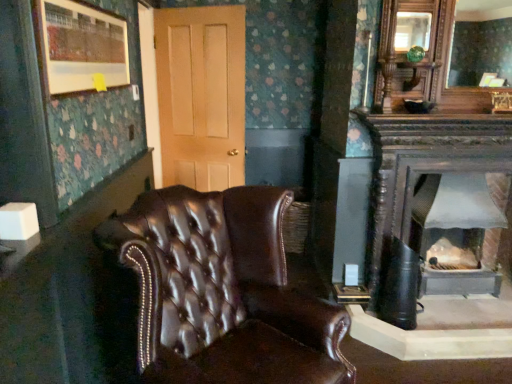
Question: Considering the relative positions of matte wooden mirror at upper right and matte wooden picture frame at upper left in the image provided, is matte wooden mirror at upper right to the right of matte wooden picture frame at upper left from the viewer's perspective?

Choices:
 (A) no
 (B) yes

Answer: (B)

Question: Would you say matte wooden mirror at upper right is outside matte wooden picture frame at upper left?

Choices:
 (A) no
 (B) yes

Answer: (B)

Question: Can you confirm if matte wooden mirror at upper right is thinner than matte wooden picture frame at upper left?

Choices:
 (A) no
 (B) yes

Answer: (A)

Question: Does matte wooden mirror at upper right appear on the left side of matte wooden picture frame at upper left?

Choices:
 (A) no
 (B) yes

Answer: (A)

Question: From the image's perspective, is matte wooden mirror at upper right on top of matte wooden picture frame at upper left?

Choices:
 (A) no
 (B) yes

Answer: (B)

Question: Is matte wooden mirror at upper right facing away from matte wooden picture frame at upper left?

Choices:
 (A) no
 (B) yes

Answer: (A)

Question: Could you tell me if matte wooden mirror at upper right is facing brown leather chair at center?

Choices:
 (A) yes
 (B) no

Answer: (B)

Question: Is matte wooden mirror at upper right positioned in front of brown leather chair at center?

Choices:
 (A) yes
 (B) no

Answer: (B)

Question: Does matte wooden mirror at upper right have a lesser height compared to brown leather chair at center?

Choices:
 (A) yes
 (B) no

Answer: (A)

Question: Are matte wooden mirror at upper right and brown leather chair at center far apart?

Choices:
 (A) yes
 (B) no

Answer: (A)

Question: From the image's perspective, does matte wooden mirror at upper right appear lower than brown leather chair at center?

Choices:
 (A) yes
 (B) no

Answer: (B)

Question: Is matte wooden mirror at upper right outside of brown leather chair at center?

Choices:
 (A) yes
 (B) no

Answer: (A)

Question: Is matte wooden picture frame at upper left closer to camera compared to gray metallic wood burning stove at right?

Choices:
 (A) no
 (B) yes

Answer: (B)